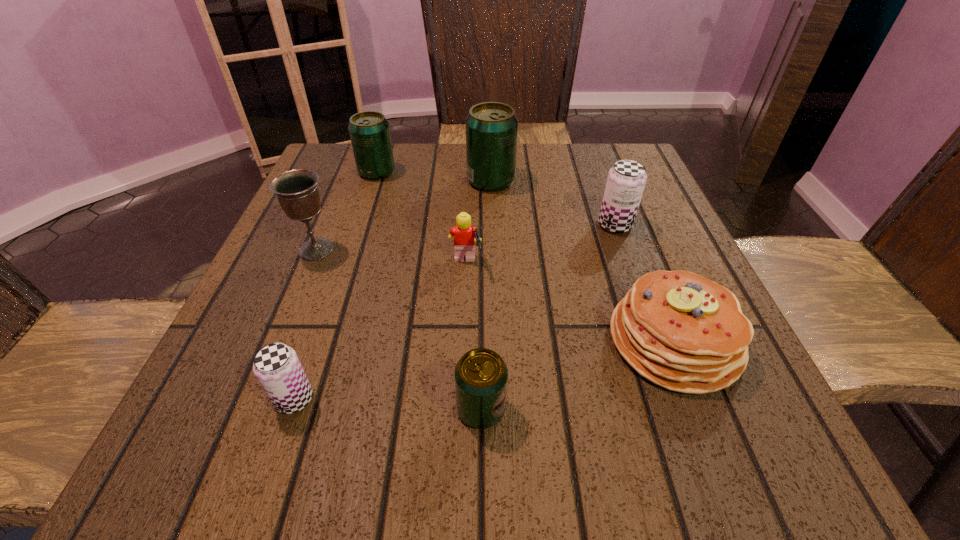
In order to click on the tallest beer can in this screenshot , I will do `click(491, 127)`.

At what (x,y) coordinates should I click in order to perform the action: click on chalice. Please return your answer as a coordinate pair (x, y). The height and width of the screenshot is (540, 960). Looking at the image, I should click on (296, 190).

The image size is (960, 540). Identify the location of the third farthest object. tap(626, 180).

Locate an element on the screen. the third nearest beer can is located at coordinates 626,180.

In order to click on the leftmost green beer can in this screenshot , I will do `click(369, 131)`.

Identify the location of Lego. The image size is (960, 540). (465, 236).

What are the coordinates of `pancake` in the screenshot? It's located at (681, 331).

The image size is (960, 540). What are the coordinates of `the smaller purple beer can` in the screenshot? It's located at (277, 367).

You are a GUI agent. You are given a task and a screenshot of the screen. Output one action in this format:
    pyautogui.click(x=<x>, y=<y>)
    Task: Click on the left purple beer can
    This screenshot has height=540, width=960.
    Given the screenshot: What is the action you would take?
    pyautogui.click(x=277, y=367)

Image resolution: width=960 pixels, height=540 pixels. I want to click on the nearest green beer can, so click(481, 375).